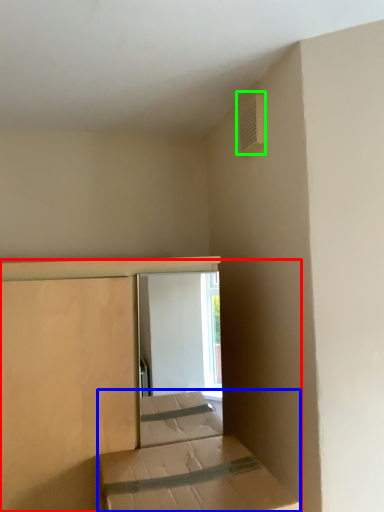
Question: Which object is the closest to the bed (highlighted by a red box)? Choose among these: bed (highlighted by a blue box) or air conditioning (highlighted by a green box).

Choices:
 (A) bed
 (B) air conditioning

Answer: (A)